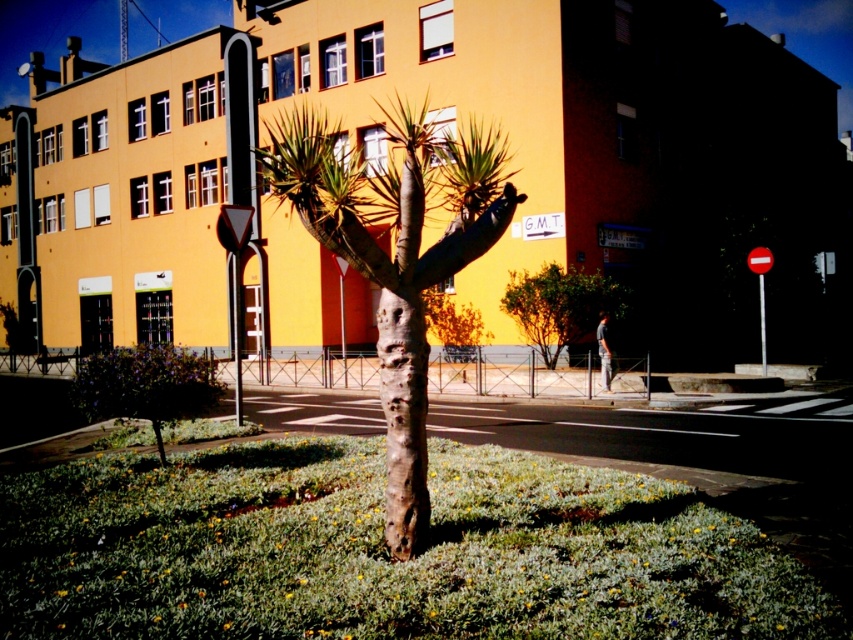
Question: Which point is farther from the camera taking this photo?

Choices:
 (A) (759, 349)
 (B) (547, 296)
 (C) (265, 173)

Answer: (A)

Question: Which of the following is the farthest from the observer?

Choices:
 (A) green leafy bush at center
 (B) red plastic sign at right
 (C) brown rough bark tree at center
 (D) green matte tree at lower left

Answer: (A)

Question: Does green matte tree at lower left appear over green leafy bush at center?

Choices:
 (A) no
 (B) yes

Answer: (A)

Question: Estimate the real-world distances between objects in this image. Which object is closer to the green leafy bush at center?

Choices:
 (A) red plastic sign at right
 (B) green matte tree at lower left

Answer: (A)

Question: Is green matte tree at lower left wider than green leafy bush at center?

Choices:
 (A) yes
 (B) no

Answer: (B)

Question: Does brown rough bark tree at center appear under green matte tree at lower left?

Choices:
 (A) yes
 (B) no

Answer: (B)